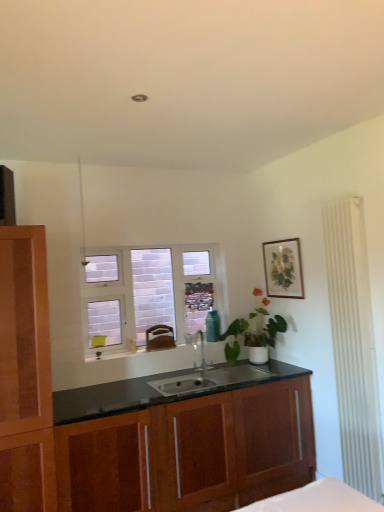
What are the coordinates of `white frosted glass window at center` in the screenshot? It's located at (148, 291).

Based on the photo, from the image's perspective, who appears lower, satin nickel faucet at center or wooden cabinet at center?

wooden cabinet at center appears lower in the image.

Considering the sizes of objects satin nickel faucet at center and wooden cabinet at center in the image provided, who is shorter, satin nickel faucet at center or wooden cabinet at center?

Standing shorter between the two is satin nickel faucet at center.

Could you tell me if satin nickel faucet at center is turned towards wooden cabinet at center?

No, satin nickel faucet at center is not aimed at wooden cabinet at center.

In the image, is wooden cabinet at center positioned in front of or behind satin nickel faucet at center?

Clearly, wooden cabinet at center is in front of satin nickel faucet at center.

Is wooden cabinet at center inside or outside of satin nickel faucet at center?

wooden cabinet at center is spatially situated outside satin nickel faucet at center.

Is wooden cabinet at center positioned far away from satin nickel faucet at center?

No, there isn't a large distance between wooden cabinet at center and satin nickel faucet at center.

Who is bigger, wooden cabinet at center or satin nickel faucet at center?

Bigger between the two is wooden cabinet at center.

Is satin nickel faucet at center oriented towards matte wooden picture frame at upper right?

No, satin nickel faucet at center is not aimed at matte wooden picture frame at upper right.

Is point (205, 368) positioned after point (294, 271)?

Yes.

Consider the image. From a real-world perspective, is satin nickel faucet at center positioned under matte wooden picture frame at upper right based on gravity?

Correct, in the physical world, satin nickel faucet at center is lower than matte wooden picture frame at upper right.

Which object is further away from the camera, white frosted glass window at center or satin nickel faucet at center?

white frosted glass window at center is further from the camera.

Which point is more distant from viewer, (115, 339) or (203, 340)?

The point (203, 340) is more distant.

Is satin nickel faucet at center a part of white frosted glass window at center?

No, white frosted glass window at center does not contain satin nickel faucet at center.

Considering the positions of objects white frosted glass window at center and satin nickel faucet at center in the image provided, who is more to the right, white frosted glass window at center or satin nickel faucet at center?

Positioned to the right is satin nickel faucet at center.

Can you confirm if wooden cabinet at center is positioned to the right of white frosted glass window at center?

Yes, wooden cabinet at center is to the right of white frosted glass window at center.

From the image's perspective, which object appears higher, wooden cabinet at center or white frosted glass window at center?

From the image's view, white frosted glass window at center is above.

Considering their positions, is wooden cabinet at center located in front of or behind white frosted glass window at center?

wooden cabinet at center is in front of white frosted glass window at center.

Is white frosted glass window at center aimed at wooden cabinet at center?

No.

In the scene shown: Considering the relative sizes of white frosted glass window at center and wooden cabinet at center in the image provided, is white frosted glass window at center bigger than wooden cabinet at center?

No.

Which is more to the right, white frosted glass window at center or wooden cabinet at center?

Positioned to the right is wooden cabinet at center.

Is satin nickel faucet at center facing towards white frosted glass window at center?

No, satin nickel faucet at center is not oriented towards white frosted glass window at center.

Visually, is satin nickel faucet at center positioned to the left or to the right of white frosted glass window at center?

From the image, it's evident that satin nickel faucet at center is to the right of white frosted glass window at center.

Looking at this image, does satin nickel faucet at center have a greater width compared to white frosted glass window at center?

Correct, the width of satin nickel faucet at center exceeds that of white frosted glass window at center.

Is white frosted glass window at center a part of satin nickel faucet at center?

No, white frosted glass window at center is not surrounded by satin nickel faucet at center.

Find the location of a particular element. The width and height of the screenshot is (384, 512). cabinetry below the satin nickel faucet at center (from the image's perspective) is located at coordinates (184, 444).

In the image, there is a wooden cabinet at center. Identify the location of tap above it (from the image's perspective). This screenshot has width=384, height=512. (201, 354).

Estimate the real-world distances between objects in this image. Which object is closer to matte wooden picture frame at upper right, white frosted glass window at center or satin nickel faucet at center?

Based on the image, satin nickel faucet at center appears to be nearer to matte wooden picture frame at upper right.

Considering their positions, is satin nickel faucet at center positioned further to matte wooden picture frame at upper right than wooden cabinet at center?

wooden cabinet at center.

When comparing their distances from matte wooden picture frame at upper right, does wooden cabinet at center or white frosted glass window at center seem closer?

Among the two, white frosted glass window at center is located nearer to matte wooden picture frame at upper right.

Looking at the image, which one is located further to matte wooden picture frame at upper right, wooden cabinet at center or satin nickel faucet at center?

wooden cabinet at center.

Looking at the image, which one is located closer to white frosted glass window at center, wooden cabinet at center or satin nickel faucet at center?

The object closer to white frosted glass window at center is satin nickel faucet at center.

From the image, which object appears to be nearer to white frosted glass window at center, matte wooden picture frame at upper right or satin nickel faucet at center?

satin nickel faucet at center lies closer to white frosted glass window at center than the other object.

Which object lies nearer to the anchor point wooden cabinet at center, satin nickel faucet at center or white frosted glass window at center?

satin nickel faucet at center.

Considering their positions, is wooden cabinet at center positioned further to satin nickel faucet at center than matte wooden picture frame at upper right?

Based on the image, matte wooden picture frame at upper right appears to be further to satin nickel faucet at center.

Locate an element on the screen. Image resolution: width=384 pixels, height=512 pixels. tap between white frosted glass window at center and wooden cabinet at center in the vertical direction is located at coordinates click(x=201, y=354).

The width and height of the screenshot is (384, 512). What are the coordinates of `window that lies between matte wooden picture frame at upper right and wooden cabinet at center from top to bottom` in the screenshot? It's located at (148, 291).

In order to click on tap between matte wooden picture frame at upper right and wooden cabinet at center in the up-down direction in this screenshot , I will do pos(201,354).

Locate an element on the screen. This screenshot has width=384, height=512. tap located between white frosted glass window at center and matte wooden picture frame at upper right in the left-right direction is located at coordinates (201, 354).